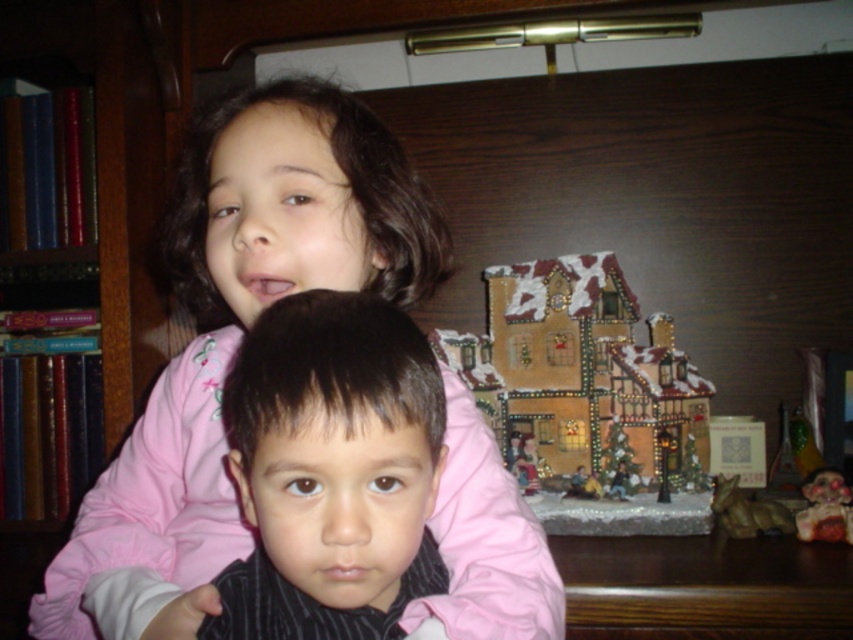
Does matte pink shirt at upper center appear on the right side of black striped shirt at center?

No, matte pink shirt at upper center is not to the right of black striped shirt at center.

Who is positioned more to the right, matte pink shirt at upper center or black striped shirt at center?

From the viewer's perspective, black striped shirt at center appears more on the right side.

Measure the distance between point (160,634) and camera.

The distance of point (160,634) from camera is 19.66 inches.

This screenshot has height=640, width=853. Identify the location of matte pink shirt at upper center. (235, 340).

Is black striped shirt at center to the right of wooden bookshelf at left from the viewer's perspective?

Correct, you'll find black striped shirt at center to the right of wooden bookshelf at left.

Is black striped shirt at center below wooden bookshelf at left?

Yes, black striped shirt at center is below wooden bookshelf at left.

Between point (384, 493) and point (112, 134), which one is positioned behind?

The point (112, 134) is more distant.

Image resolution: width=853 pixels, height=640 pixels. In order to click on black striped shirt at center in this screenshot , I will do [331, 470].

Is matte pink shirt at upper center positioned behind wooden bookshelf at left?

No, matte pink shirt at upper center is closer to the viewer.

Is the position of matte pink shirt at upper center less distant than that of wooden bookshelf at left?

That is True.

Is point (338, 269) in front of point (103, 20)?

Yes, point (338, 269) is closer to viewer.

You are a GUI agent. You are given a task and a screenshot of the screen. Output one action in this format:
    pyautogui.click(x=<x>, y=<y>)
    Task: Click on the matte pink shirt at upper center
    This screenshot has width=853, height=640.
    Given the screenshot: What is the action you would take?
    point(235,340)